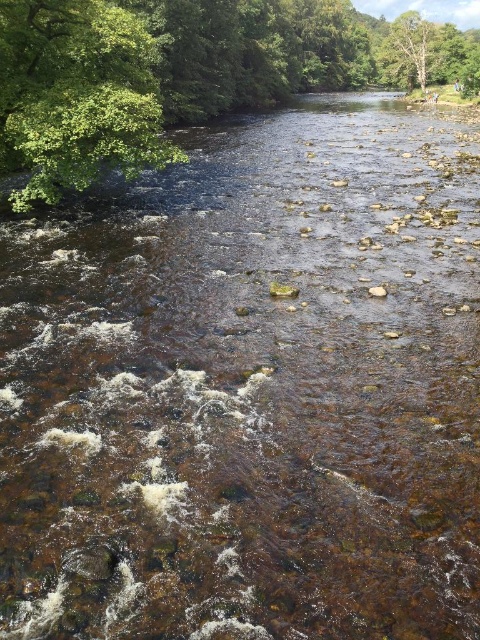
Can you confirm if green leafy tree at left is wider than brown smooth rock at center?

Yes.

Does green leafy tree at left lie behind brown smooth rock at center?

Yes, green leafy tree at left is behind brown smooth rock at center.

This screenshot has width=480, height=640. Find the location of `green leafy tree at left`. green leafy tree at left is located at coordinates (75, 96).

Image resolution: width=480 pixels, height=640 pixels. I want to click on green leafy tree at left, so click(x=75, y=96).

Who is more forward, [98,93] or [93,33]?

Point [98,93] is in front.

Can you confirm if green leafy tree at upper left is thinner than green leafy tree at left?

In fact, green leafy tree at upper left might be wider than green leafy tree at left.

Identify the location of green leafy tree at upper left. (182, 74).

Is green leafy tree at upper left wider than green leafy tree at upper right?

Indeed, green leafy tree at upper left has a greater width compared to green leafy tree at upper right.

Can you confirm if green leafy tree at upper left is shorter than green leafy tree at upper right?

Incorrect, green leafy tree at upper left's height does not fall short of green leafy tree at upper right's.

Is point (32, 120) more distant than point (382, 56)?

No, (32, 120) is in front of (382, 56).

You are a GUI agent. You are given a task and a screenshot of the screen. Output one action in this format:
    pyautogui.click(x=<x>, y=<y>)
    Task: Click on the green leafy tree at upper left
    
    Given the screenshot: What is the action you would take?
    pyautogui.click(x=182, y=74)